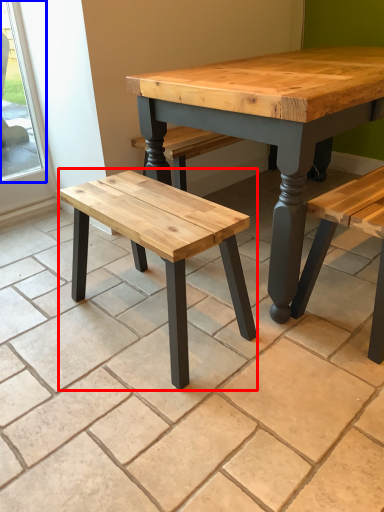
Question: Which object appears farthest to the camera in this image, stool (highlighted by a red box) or window (highlighted by a blue box)?

Choices:
 (A) stool
 (B) window

Answer: (B)